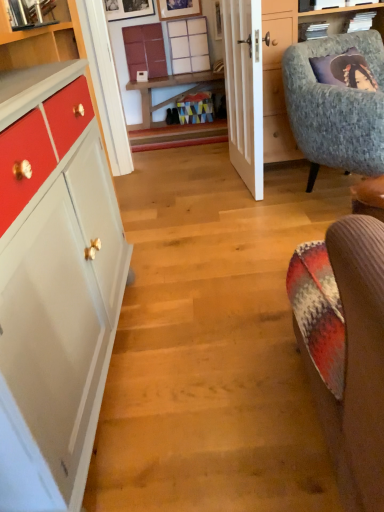
Question: Which is correct: matte wood cabinet at upper center is inside matte wood counter top at upper left, or outside of it?

Choices:
 (A) inside
 (B) outside

Answer: (B)

Question: Is matte wood cabinet at upper center in front of or behind matte wood counter top at upper left in the image?

Choices:
 (A) behind
 (B) front

Answer: (A)

Question: Which is farther from the textured gray armchair at upper right?

Choices:
 (A) wooden table at center
 (B) matte wood cabinet at upper center
 (C) wooden picture frame at upper center, which is the first picture frame in left-to-right order
 (D) white grid shelf at upper center
 (E) matte wooden picture frame at upper center, the second picture frame positioned from the left

Answer: (C)

Question: Which of these objects is positioned closest to the white wooden door at center?

Choices:
 (A) textured gray armchair at upper right
 (B) matte wooden picture frame at upper center, which ranks as the first picture frame in right-to-left order
 (C) wooden picture frame at upper center, which is the first picture frame in left-to-right order
 (D) white grid shelf at upper center
 (E) wooden table at center

Answer: (A)